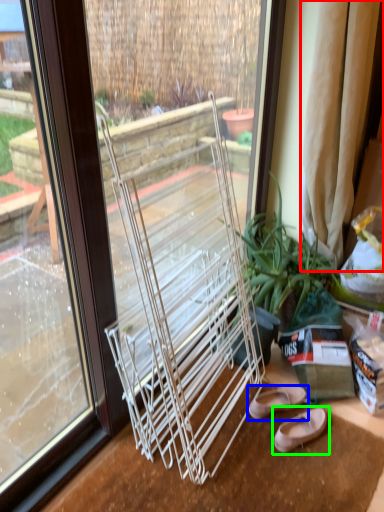
Question: Which object is the closest to the curtain (highlighted by a red box)? Choose among these: footwear (highlighted by a blue box) or footwear (highlighted by a green box).

Choices:
 (A) footwear
 (B) footwear

Answer: (A)